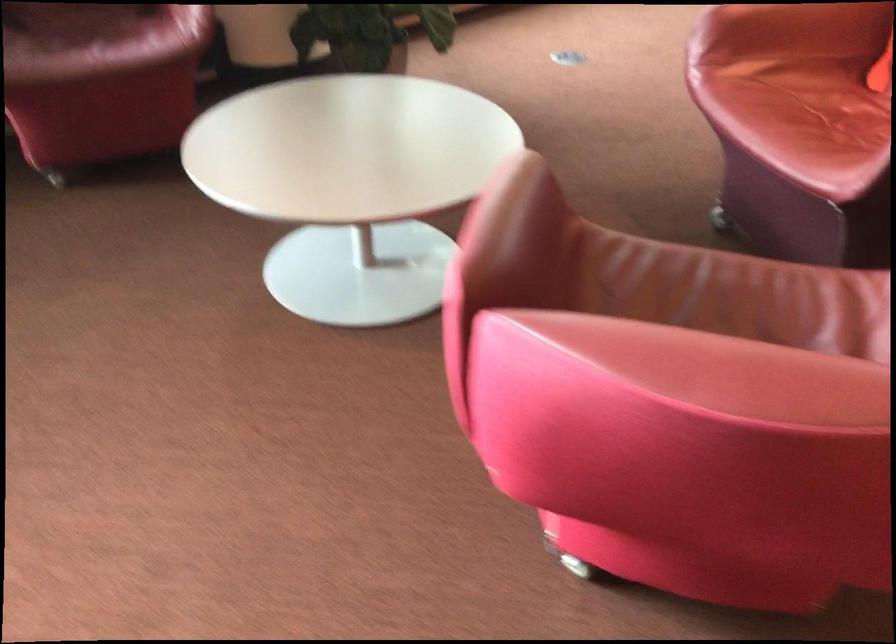
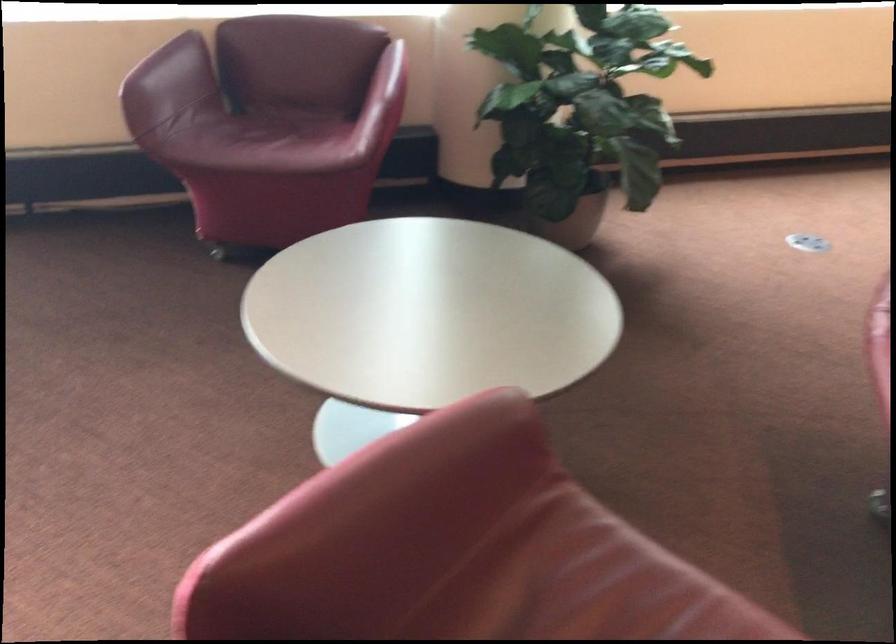
Question: The images are taken continuously from a first-person perspective. In which direction is your viewpoint rotating?

Choices:
 (A) Left
 (B) Right
 (C) Up
 (D) Down

Answer: (A)